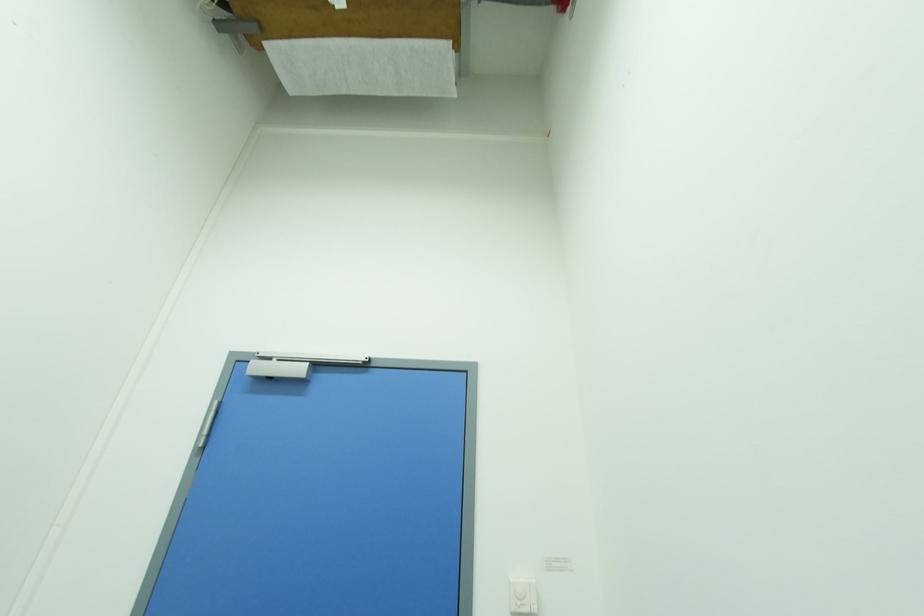
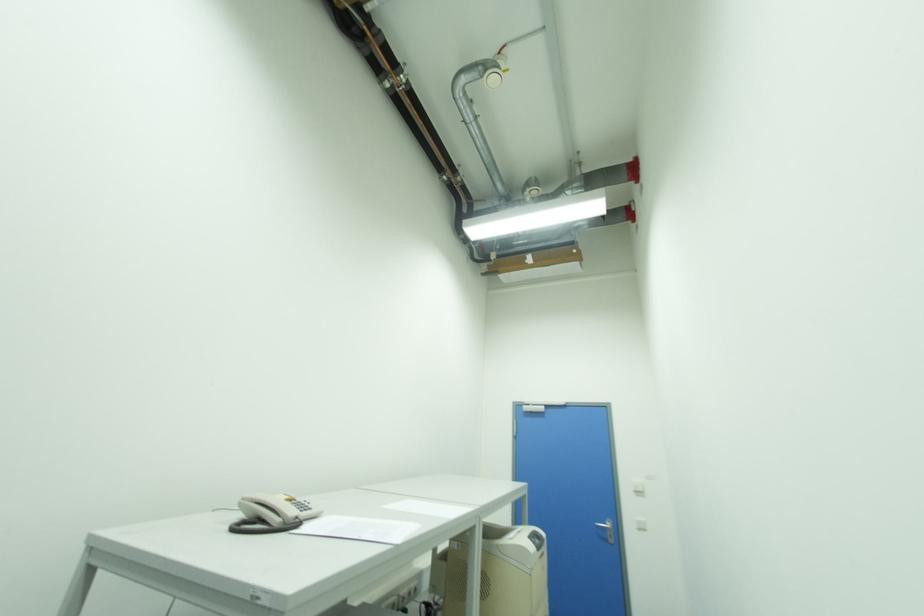
Question: The images are taken continuously from a first-person perspective. In which direction are you moving?

Choices:
 (A) Left
 (B) Right
 (C) Forward
 (D) Backward

Answer: (D)